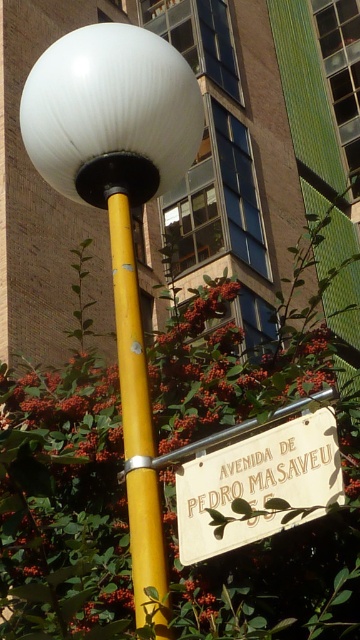
Question: Can you confirm if white glossy street light at upper left is thinner than white glossy sphere at upper left?

Choices:
 (A) yes
 (B) no

Answer: (A)

Question: Does white glossy street light at upper left appear under yellow matte pole at center?

Choices:
 (A) no
 (B) yes

Answer: (A)

Question: Which object appears closest to the camera in this image?

Choices:
 (A) green leafy bush at center
 (B) yellow matte pole at center
 (C) wooden sign at lower center
 (D) white glossy sphere at upper left

Answer: (A)

Question: Which object is positioned farthest from the green leafy bush at center?

Choices:
 (A) yellow matte pole at center
 (B) white glossy sphere at upper left
 (C) white glossy street light at upper left
 (D) wooden sign at lower center

Answer: (B)

Question: Does white glossy street light at upper left have a greater width compared to yellow matte pole at center?

Choices:
 (A) yes
 (B) no

Answer: (A)

Question: Which of these objects is positioned closest to the yellow matte pole at center?

Choices:
 (A) wooden sign at lower center
 (B) white glossy sphere at upper left
 (C) white glossy street light at upper left

Answer: (C)